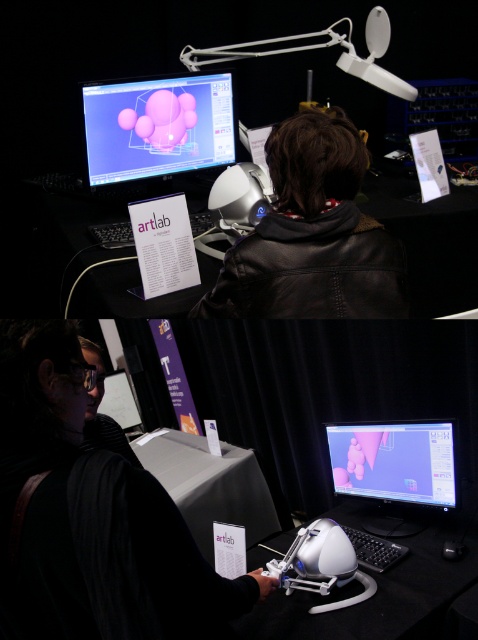
Which is behind, point (349, 499) or point (371, 454)?

Positioned behind is point (349, 499).

At what (x,y) coordinates should I click in order to perform the action: click on white plastic table at center. Please return your answer as a coordinate pair (x, y). This screenshot has height=640, width=478. Looking at the image, I should click on (380, 593).

Locate an element on the screen. white plastic table at center is located at coordinates (380, 593).

Between point (108, 579) and point (351, 24), which one is positioned behind?

The point (351, 24) is behind.

Identify the location of black matte jacket at center. (90, 516).

Is black matte jacket at center in front of matte plastic monitor at center?

Yes, black matte jacket at center is in front of matte plastic monitor at center.

Which is in front, point (112, 465) or point (402, 448)?

Point (112, 465) is more forward.

Where is `black matte jacket at center`? The image size is (478, 640). black matte jacket at center is located at coordinates 90,516.

At what (x,y) coordinates should I click in order to perform the action: click on black matte jacket at center. Please return your answer as a coordinate pair (x, y). Looking at the image, I should click on (90, 516).